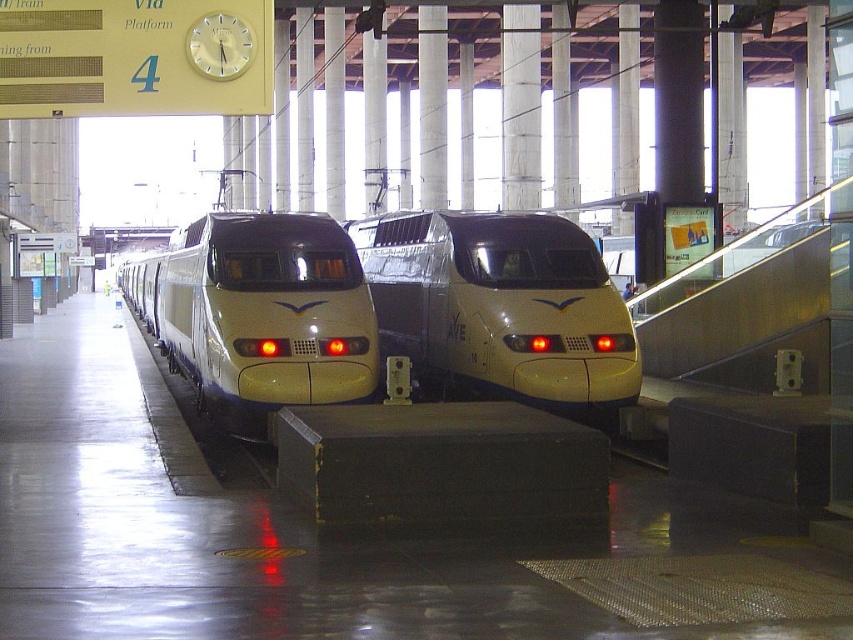
Which is behind, point (560, 230) or point (175, 300)?

The point (175, 300) is behind.

Which is below, white glossy passenger train at center or white glossy train at center?

white glossy train at center

This screenshot has height=640, width=853. Describe the element at coordinates (498, 305) in the screenshot. I see `white glossy passenger train at center` at that location.

Identify the location of white glossy passenger train at center. This screenshot has height=640, width=853. (498, 305).